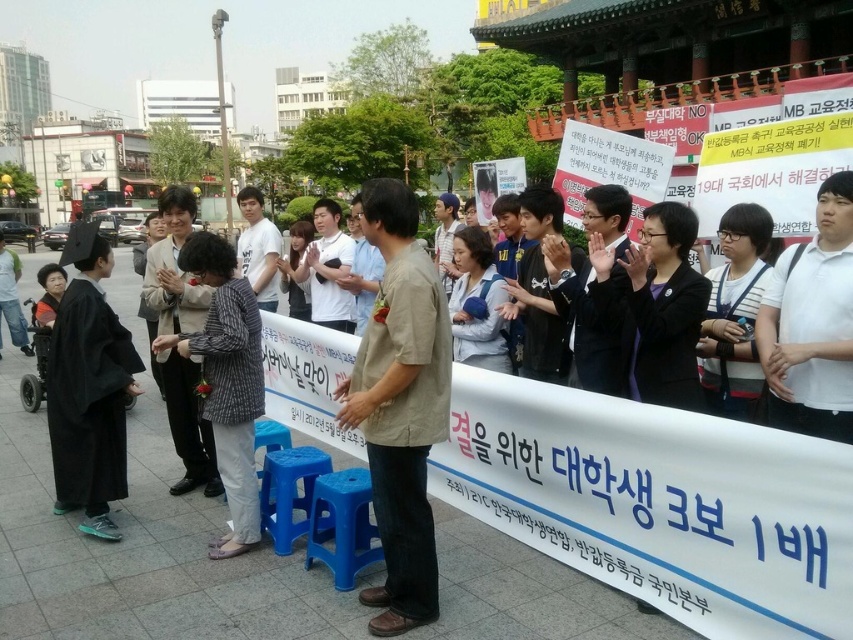
Can you confirm if black matte graduation gown at left is positioned to the right of striped fabric shirt at center?

Incorrect, black matte graduation gown at left is not on the right side of striped fabric shirt at center.

Can you confirm if black matte graduation gown at left is positioned below striped fabric shirt at center?

Yes.

You are a GUI agent. You are given a task and a screenshot of the screen. Output one action in this format:
    pyautogui.click(x=<x>, y=<y>)
    Task: Click on the black matte graduation gown at left
    The height and width of the screenshot is (640, 853).
    Given the screenshot: What is the action you would take?
    pyautogui.click(x=90, y=388)

Who is positioned more to the left, khaki cotton shirt at center or plaid fabric jacket at center?

From the viewer's perspective, plaid fabric jacket at center appears more on the left side.

Between point (399, 561) and point (204, 349), which one is positioned in front?

Point (399, 561) is more forward.

Measure the distance between khaki cotton shirt at center and camera.

9.81 feet

Where is `khaki cotton shirt at center`? The width and height of the screenshot is (853, 640). khaki cotton shirt at center is located at coordinates (399, 404).

Which is below, black matte graduation gown at left or plaid fabric jacket at center?

Positioned lower is plaid fabric jacket at center.

Image resolution: width=853 pixels, height=640 pixels. In order to click on black matte graduation gown at left in this screenshot , I will do `click(90, 388)`.

The width and height of the screenshot is (853, 640). What do you see at coordinates (90, 388) in the screenshot?
I see `black matte graduation gown at left` at bounding box center [90, 388].

At what (x,y) coordinates should I click in order to perform the action: click on black matte graduation gown at left. Please return your answer as a coordinate pair (x, y). Looking at the image, I should click on (90, 388).